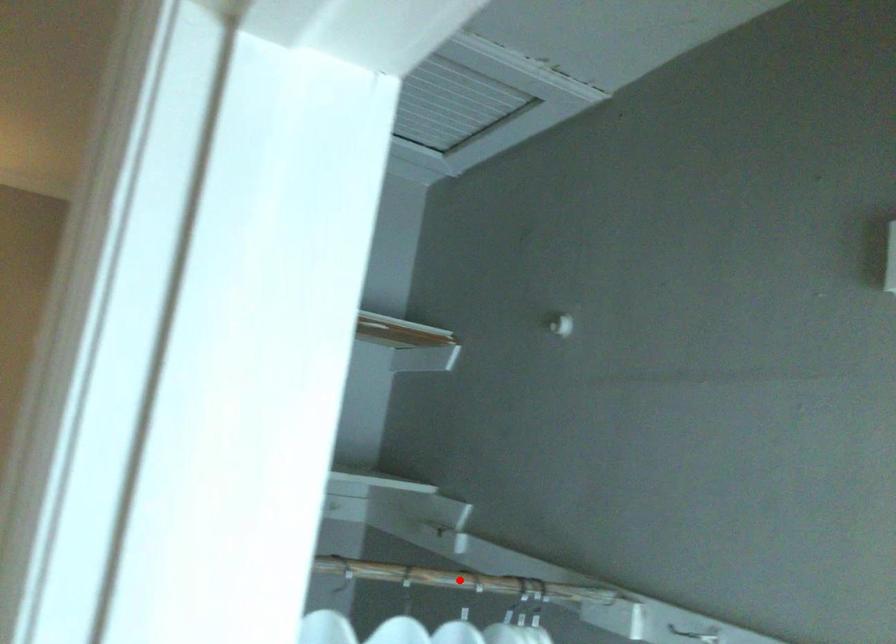
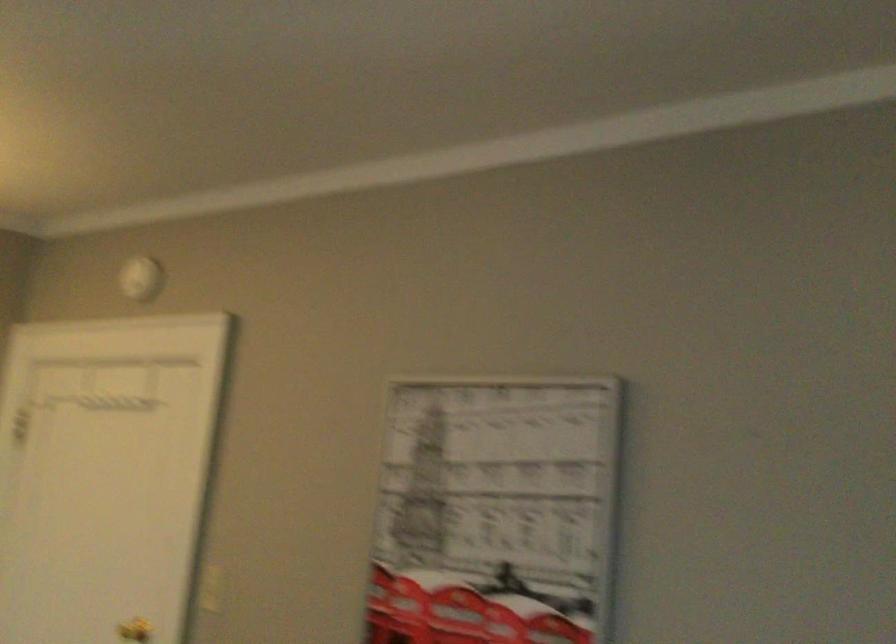
Question: I am providing you with two images of the same scene from different viewpoints. A red point is marked on the first image. Can you still see the location of the red point in image 2?

Choices:
 (A) Yes
 (B) No

Answer: (B)